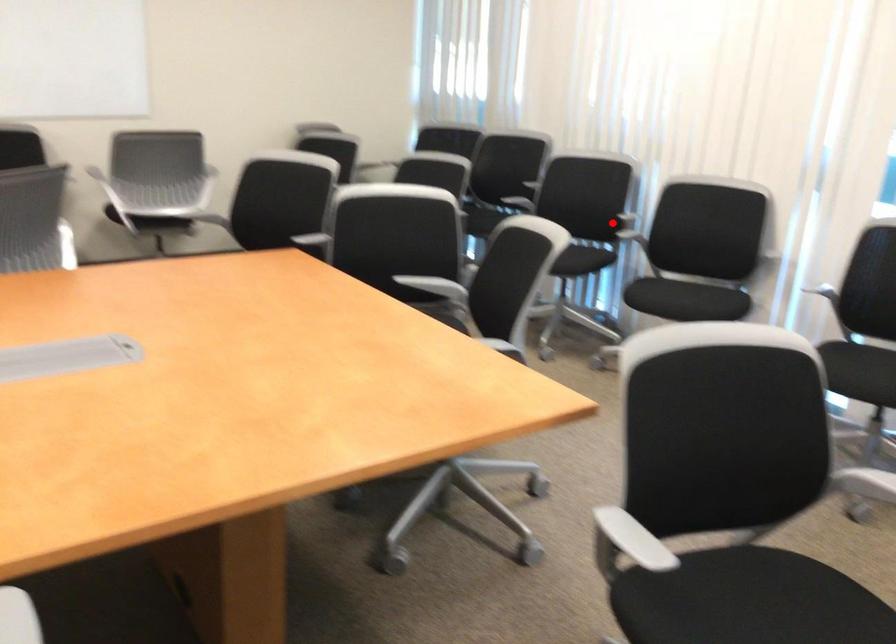
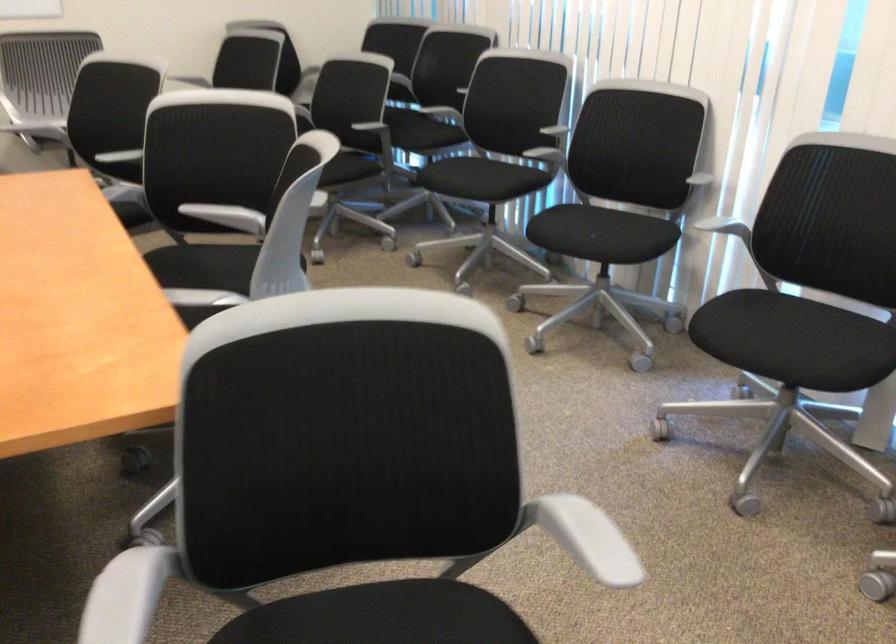
Question: I am providing you with two images of the same scene from different viewpoints. In image1, a red point is highlighted. Considering the same 3D point in image2, which of the following is correct?

Choices:
 (A) It is closer
 (B) It is farther

Answer: (A)